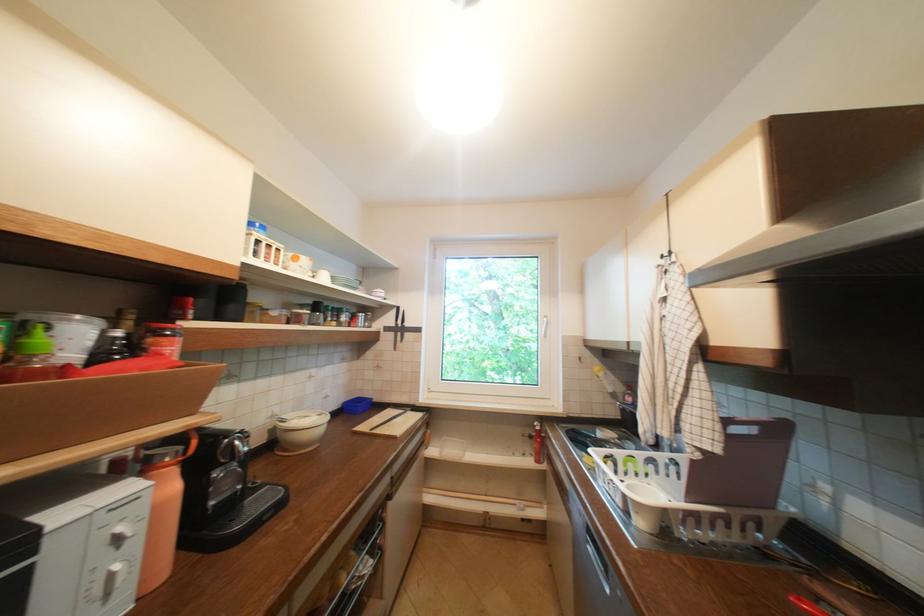
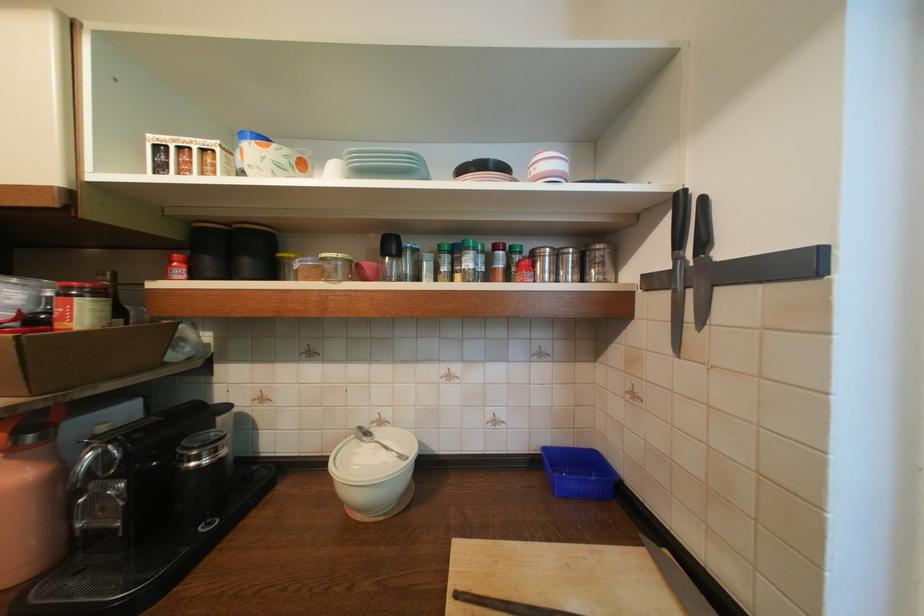
In the second image, find the point that corresponds to point (379, 322) in the first image.

(611, 265)